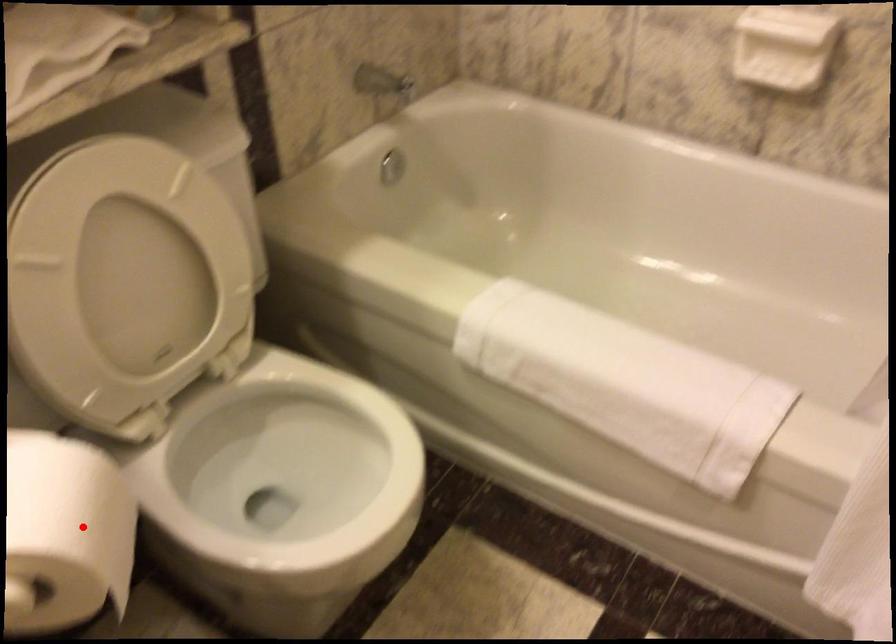
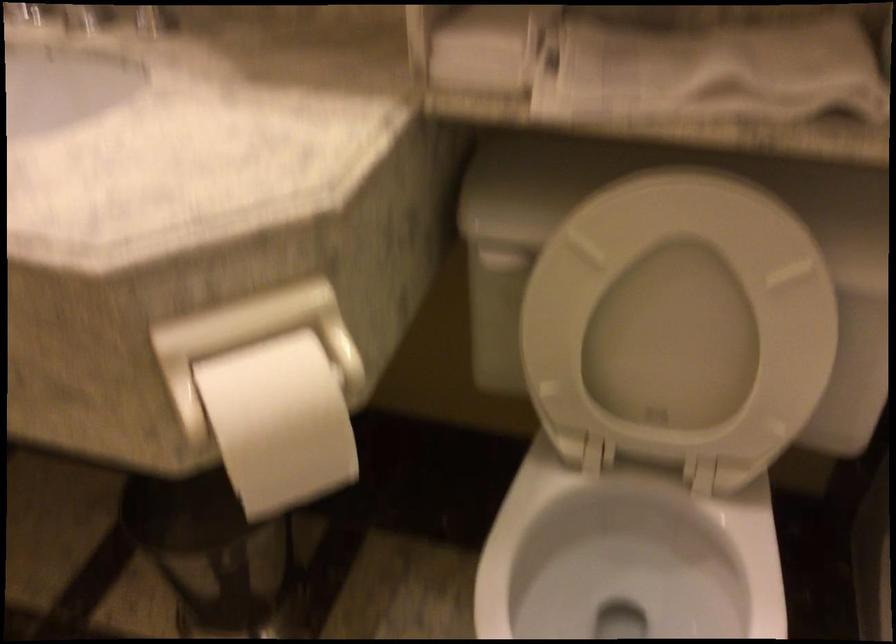
The point at the highlighted location is marked in the first image. Where is the corresponding point in the second image?

(279, 422)